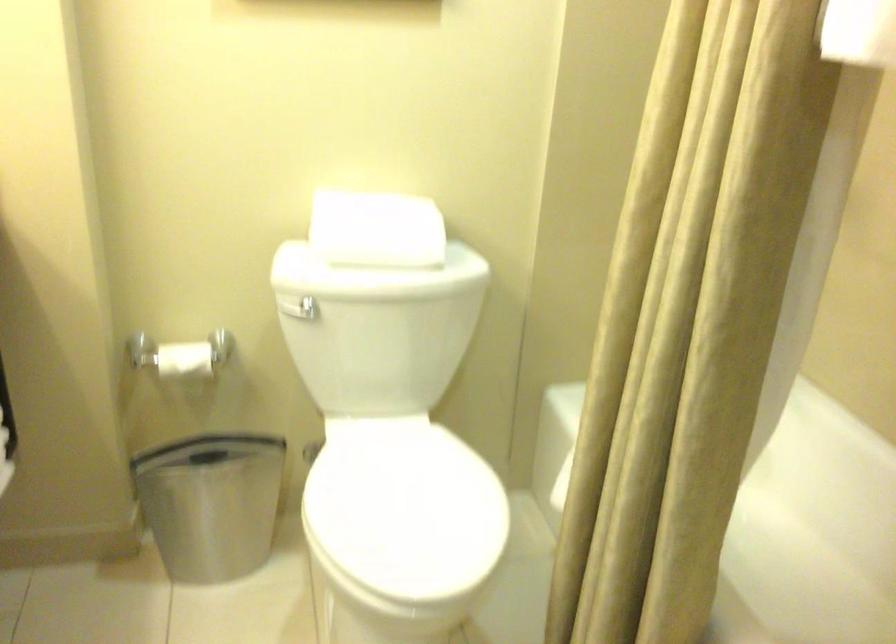
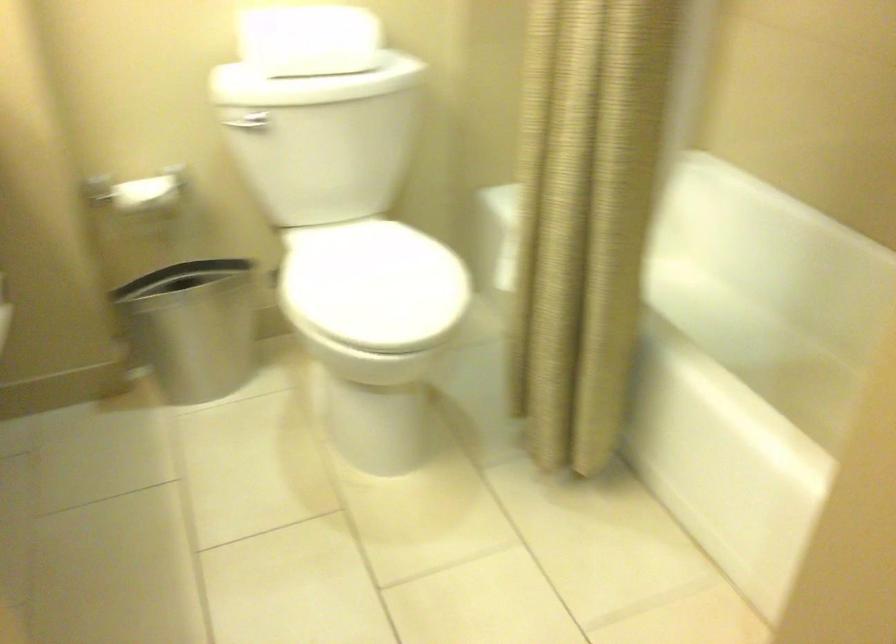
Find the pixel in the second image that matches point 645,502 in the first image.

(583, 230)